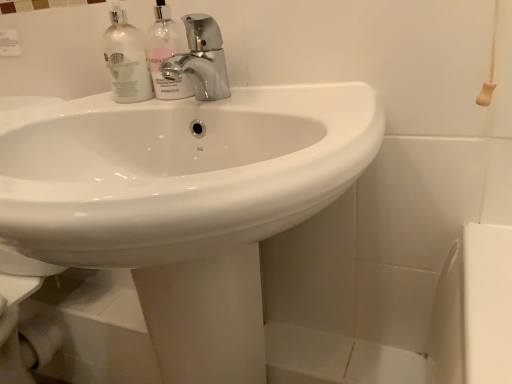
You are a GUI agent. You are given a task and a screenshot of the screen. Output one action in this format:
    pyautogui.click(x=<x>, y=<y>)
    Task: Click on the free spot to the left of chrome metallic faucet at center
    This screenshot has height=384, width=512.
    Given the screenshot: What is the action you would take?
    pyautogui.click(x=109, y=101)